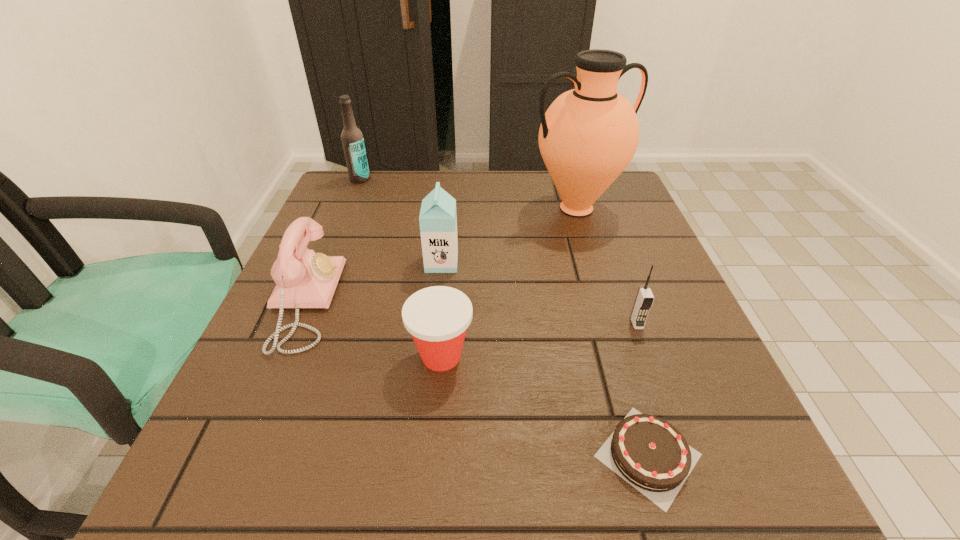
Where is `pitcher`? pitcher is located at coordinates pos(588,136).

Locate an element on the screen. The width and height of the screenshot is (960, 540). the tallest object is located at coordinates (588, 136).

You are a GUI agent. You are given a task and a screenshot of the screen. Output one action in this format:
    pyautogui.click(x=<x>, y=<y>)
    Task: Click on the second tallest object
    
    Given the screenshot: What is the action you would take?
    pyautogui.click(x=352, y=139)

The width and height of the screenshot is (960, 540). What are the coordinates of `beer bottle` in the screenshot? It's located at click(352, 139).

I want to click on the third tallest object, so click(438, 219).

You are a GUI agent. You are given a task and a screenshot of the screen. Output one action in this format:
    pyautogui.click(x=<x>, y=<y>)
    Task: Click on the telephone
    The image size is (960, 540).
    Given the screenshot: What is the action you would take?
    coord(304,279)

Where is `cellular telephone`? The width and height of the screenshot is (960, 540). cellular telephone is located at coordinates (644, 299).

At what (x,y) coordinates should I click in order to perform the action: click on Dixie cup. Please return your answer as a coordinate pair (x, y). Looking at the image, I should click on (437, 317).

The width and height of the screenshot is (960, 540). What are the coordinates of `the nearest object` in the screenshot? It's located at (648, 452).

Image resolution: width=960 pixels, height=540 pixels. In order to click on the shortest object in this screenshot , I will do `click(648, 452)`.